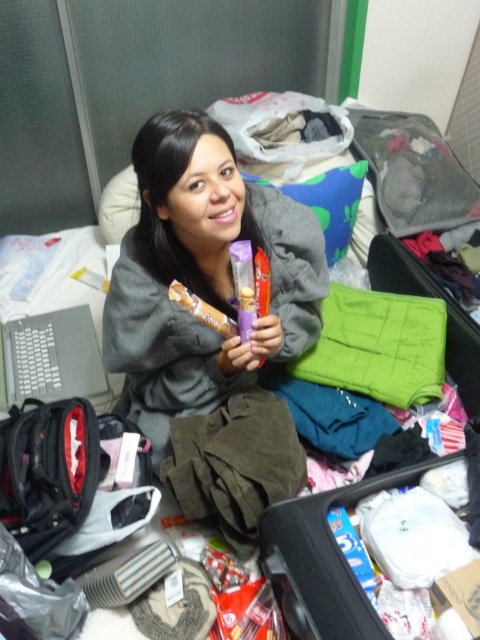
You are a person who just arrived at a hotel and need to put your gray soft sweater at center into the closet. Where should you place it?

You should place the gray soft sweater at center into the closet since it is located at the center of the room, which is a common area for storing clothing items.